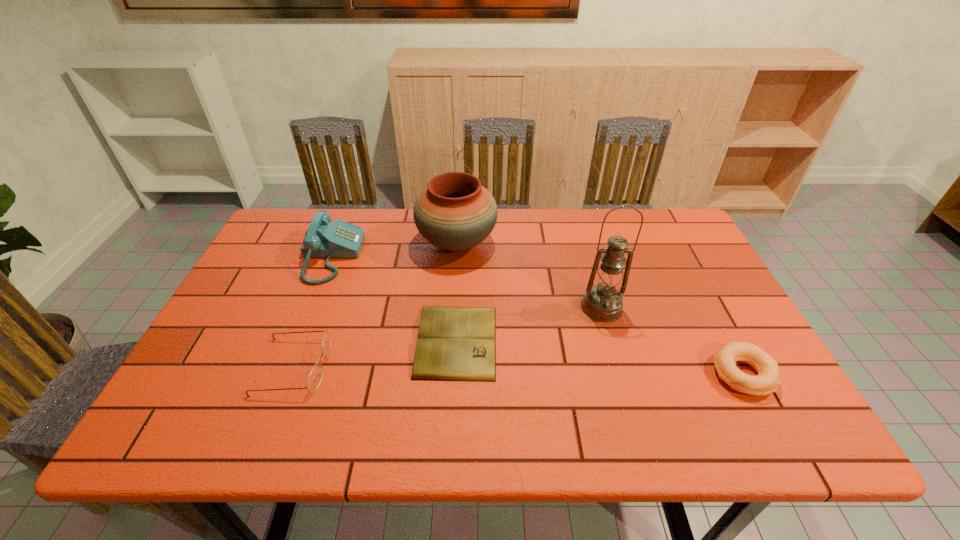
Where is `free region located on the front-facing side of the spectacles`? Image resolution: width=960 pixels, height=540 pixels. free region located on the front-facing side of the spectacles is located at coordinates (405, 367).

I want to click on vacant space located 0.240m on the left of the rightmost object, so click(x=607, y=374).

Image resolution: width=960 pixels, height=540 pixels. In order to click on free location located 0.090m on the left of the book in this screenshot , I will do `click(379, 341)`.

The width and height of the screenshot is (960, 540). I want to click on pottery that is at the far edge, so tap(455, 212).

Find the location of a particular element. The height and width of the screenshot is (540, 960). telephone positioned at the far edge is located at coordinates (324, 239).

Where is `telephone present at the left edge`? telephone present at the left edge is located at coordinates (324, 239).

Locate an element on the screen. Image resolution: width=960 pixels, height=540 pixels. spectacles located at the left edge is located at coordinates (315, 377).

Image resolution: width=960 pixels, height=540 pixels. I want to click on object located in the right edge section of the desktop, so click(x=767, y=381).

Where is `object that is at the far left corner`? The image size is (960, 540). object that is at the far left corner is located at coordinates (324, 239).

In the image, there is a desktop. Identify the location of blank space at the far edge. The width and height of the screenshot is (960, 540). (380, 235).